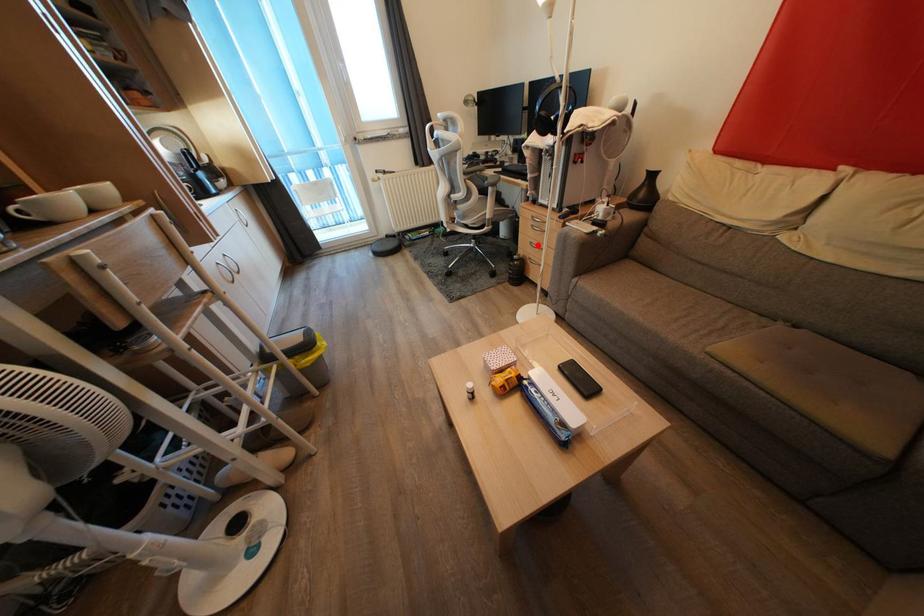
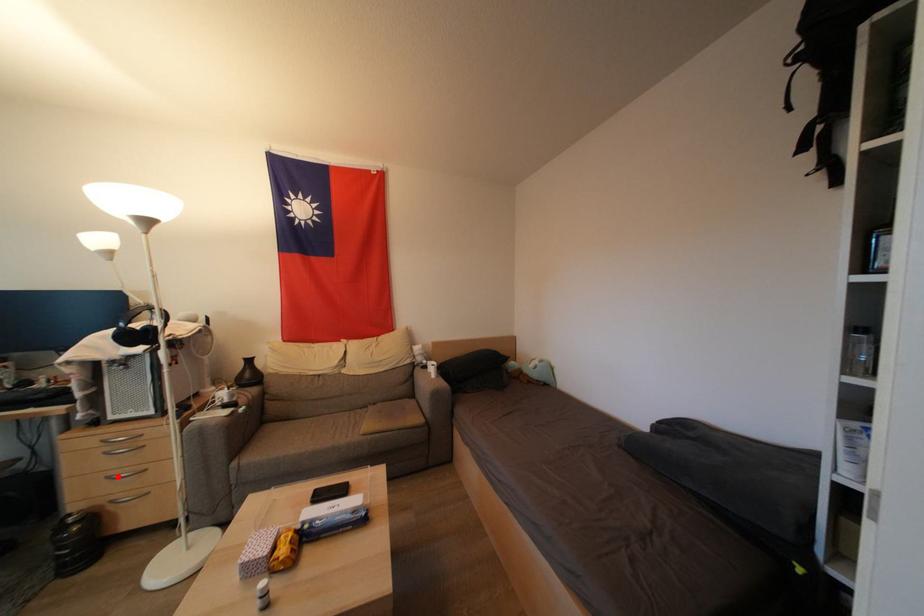
I am providing you with two images of the same scene from different viewpoints. A red point is marked on the first image and another point is marked on the second image. Are the points marked in image1 and image2 representing the same 3D position?

Yes